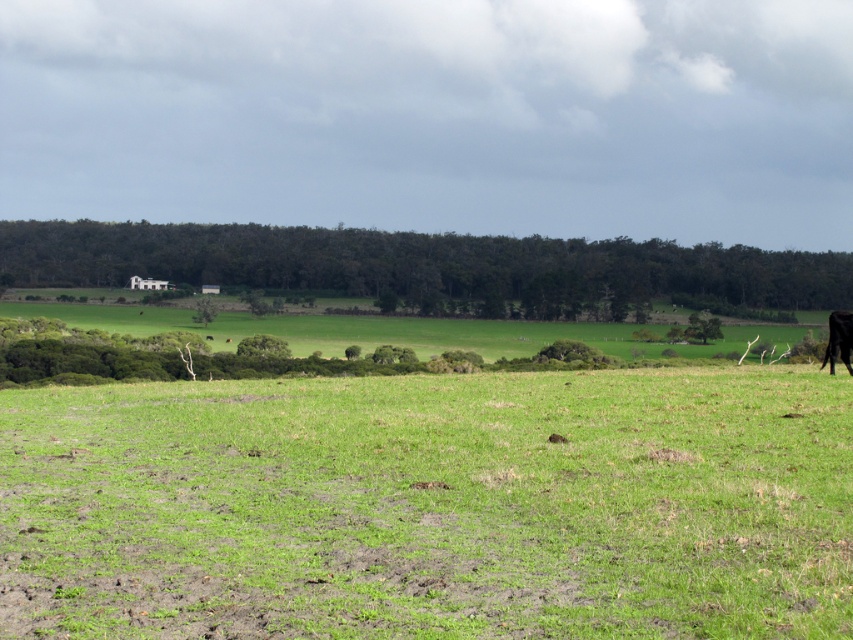
Which of these two, green grassy hillside at upper center or black fur at right, stands taller?

green grassy hillside at upper center

Describe the element at coordinates (425, 266) in the screenshot. The width and height of the screenshot is (853, 640). I see `green grassy hillside at upper center` at that location.

I want to click on green grassy hillside at upper center, so click(425, 266).

Who is shorter, green grassy pasture at center or green grassy hillside at upper center?

Standing shorter between the two is green grassy pasture at center.

Does point (74, 509) come in front of point (566, 300)?

That is True.

Between point (585, 404) and point (641, 298), which one is positioned in front?

Positioned in front is point (585, 404).

Where is `green grassy pasture at center`? green grassy pasture at center is located at coordinates coord(431,506).

What do you see at coordinates (431, 506) in the screenshot? I see `green grassy pasture at center` at bounding box center [431, 506].

Find the location of `green grassy pasture at center`. green grassy pasture at center is located at coordinates (x=431, y=506).

Is point (165, 436) more distant than point (840, 348)?

No, it is in front of (840, 348).

You are a GUI agent. You are given a task and a screenshot of the screen. Output one action in this format:
    pyautogui.click(x=<x>, y=<y>)
    Task: Click on the green grassy pasture at center
    
    Given the screenshot: What is the action you would take?
    pyautogui.click(x=431, y=506)